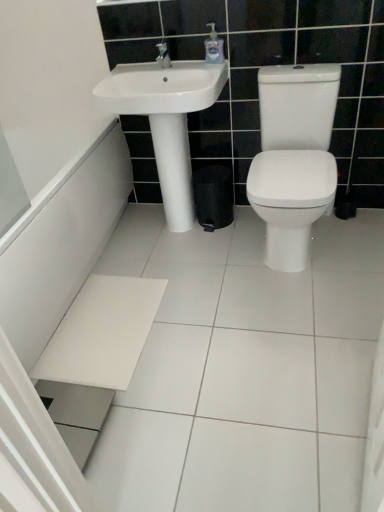
The image size is (384, 512). I want to click on vacant position to the left of clear plastic soap dispenser at upper center, so pyautogui.click(x=182, y=64).